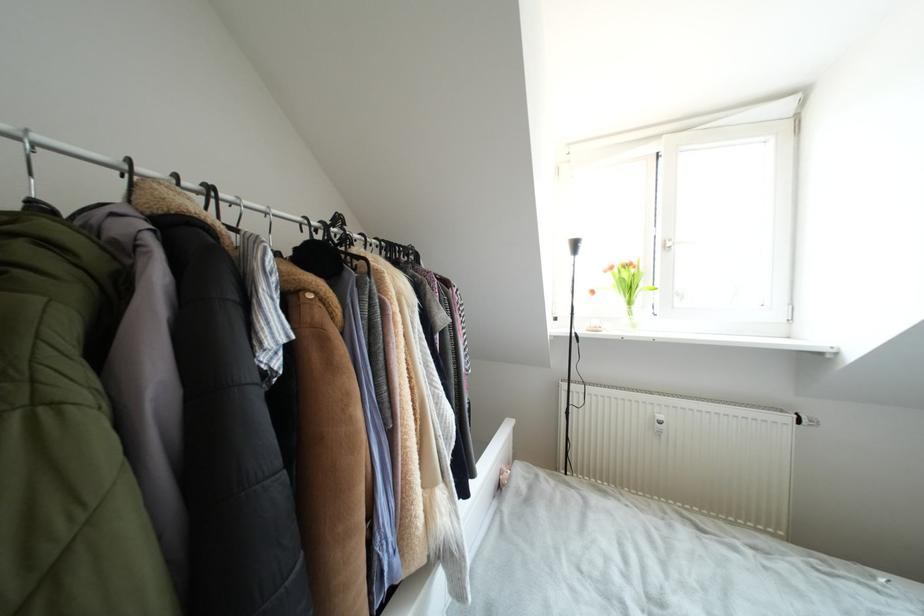
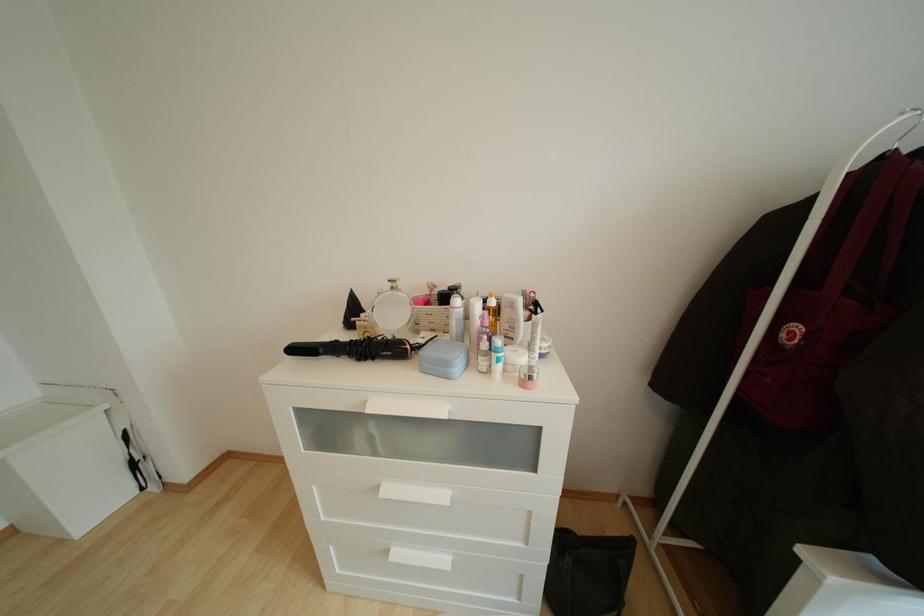
How did the camera likely rotate?

The camera rotated toward left-down.